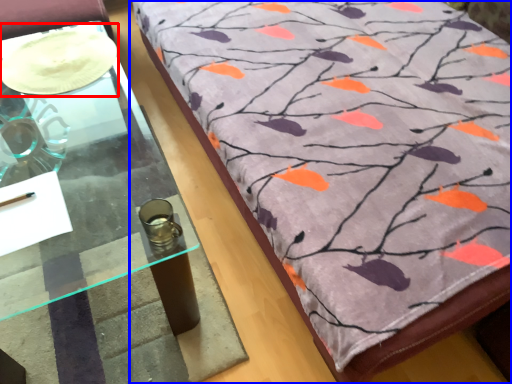
Question: Which of the following is the closest to the observer, glass plate (highlighted by a red box) or furniture (highlighted by a blue box)?

Choices:
 (A) glass plate
 (B) furniture

Answer: (B)